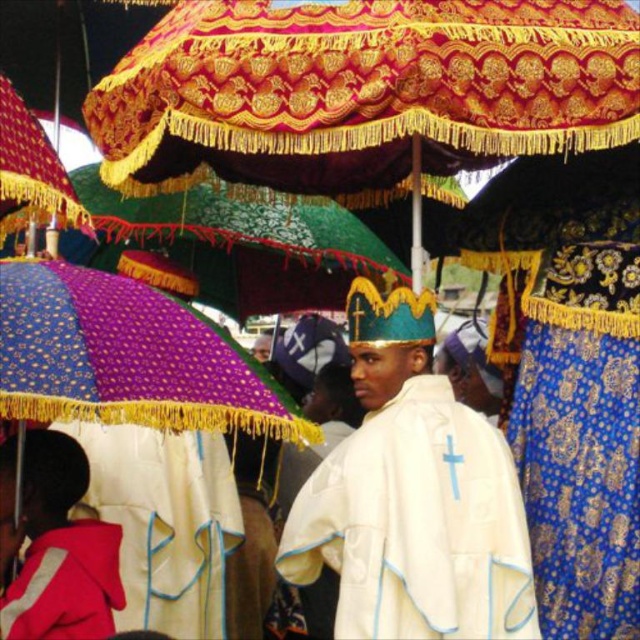
Question: Which point is farther from the camera taking this photo?

Choices:
 (A) (22, 628)
 (B) (417, 461)

Answer: (B)

Question: Where is white satin robe at center located in relation to red fleece jacket at lower left in the image?

Choices:
 (A) above
 (B) below

Answer: (A)

Question: Among these points, which one is nearest to the camera?

Choices:
 (A) (97, 545)
 (B) (426, 515)

Answer: (B)

Question: Which of the following is the farthest from the observer?

Choices:
 (A) (112, 625)
 (B) (529, 556)

Answer: (B)

Question: Can you confirm if white satin robe at center is positioned above red fleece jacket at lower left?

Choices:
 (A) no
 (B) yes

Answer: (B)

Question: Can you confirm if white satin robe at center is wider than red fleece jacket at lower left?

Choices:
 (A) no
 (B) yes

Answer: (B)